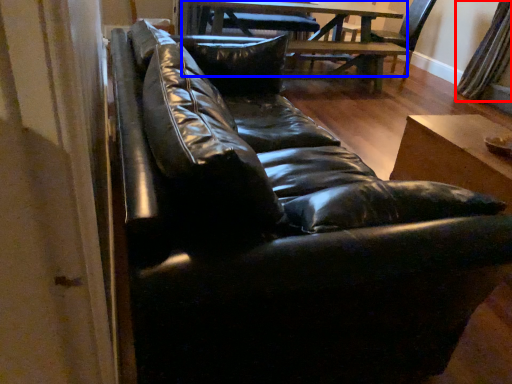
Question: Which of the following is the closest to the observer, curtain (highlighted by a red box) or table (highlighted by a blue box)?

Choices:
 (A) curtain
 (B) table

Answer: (B)